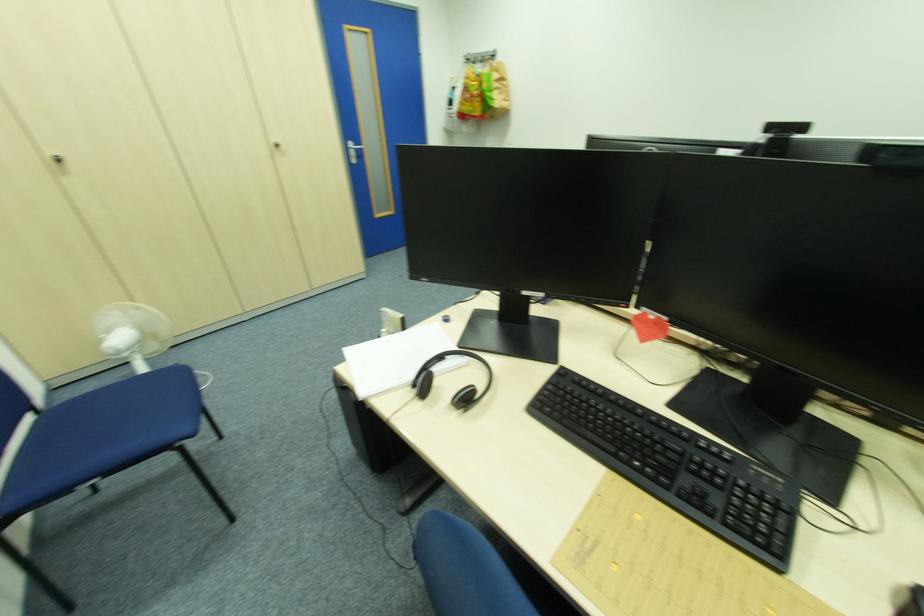
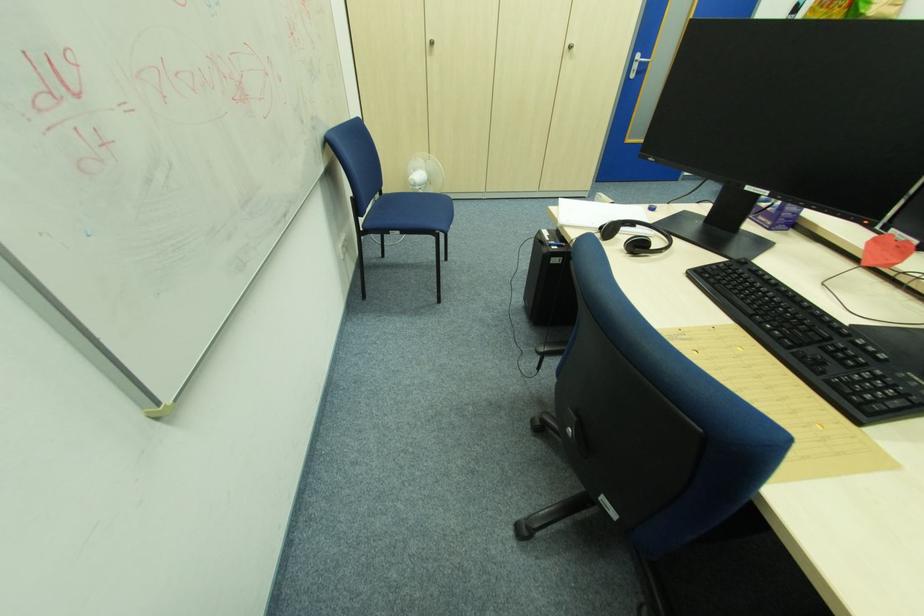
Where in the second image is the point corresponding to (x=38, y=421) from the first image?

(383, 197)